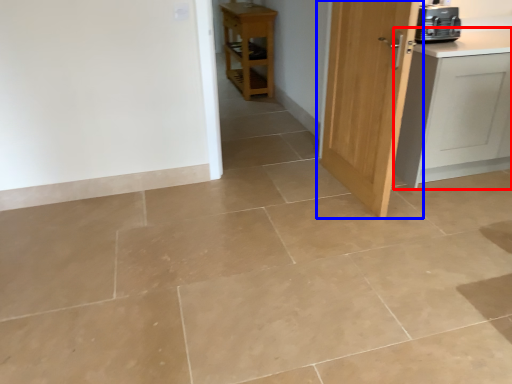
Question: Among these objects, which one is farthest to the camera, cabinetry (highlighted by a red box) or door (highlighted by a blue box)?

Choices:
 (A) cabinetry
 (B) door

Answer: (A)